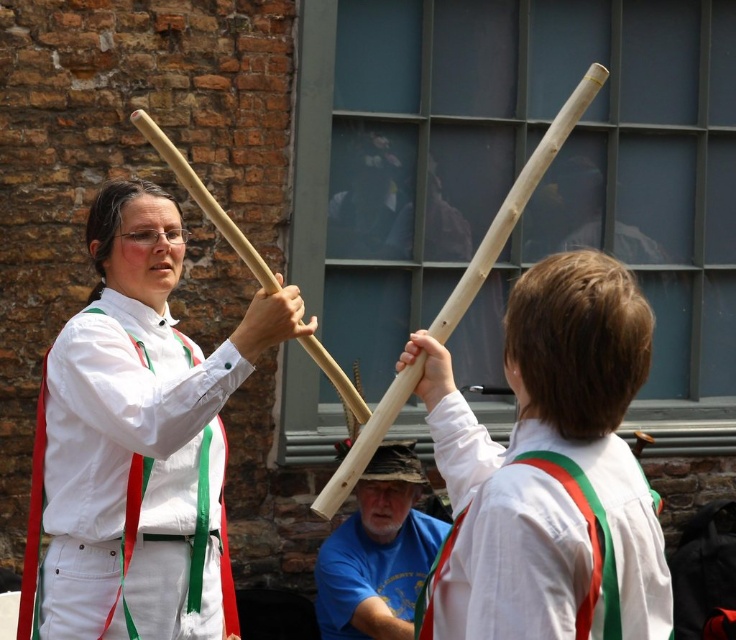
Is white cotton shirt at upper right smaller than blue t-shirt at center?

Yes, white cotton shirt at upper right is smaller than blue t-shirt at center.

Is white cotton shirt at upper right further to the viewer compared to blue t-shirt at center?

No, white cotton shirt at upper right is in front of blue t-shirt at center.

Is point (539, 496) farther from camera compared to point (347, 545)?

No, (539, 496) is in front of (347, 545).

Find the location of a particular element. This screenshot has height=640, width=736. white cotton shirt at upper right is located at coordinates (542, 538).

Between matte wood stick at center and white cotton shirt at upper right, which one appears on the left side from the viewer's perspective?

From the viewer's perspective, matte wood stick at center appears more on the left side.

Is matte wood stick at center smaller than white cotton shirt at upper right?

No.

Which is behind, point (95, 442) or point (523, 518)?

The point (95, 442) is more distant.

I want to click on matte wood stick at center, so click(x=138, y=436).

Can you confirm if matte wood stick at center is thinner than blue t-shirt at center?

No, matte wood stick at center is not thinner than blue t-shirt at center.

Between matte wood stick at center and blue t-shirt at center, which one appears on the right side from the viewer's perspective?

Positioned to the right is blue t-shirt at center.

Who is more forward, (146,326) or (375,566)?

Point (146,326)

This screenshot has width=736, height=640. Find the location of `matte wood stick at center`. matte wood stick at center is located at coordinates (138, 436).